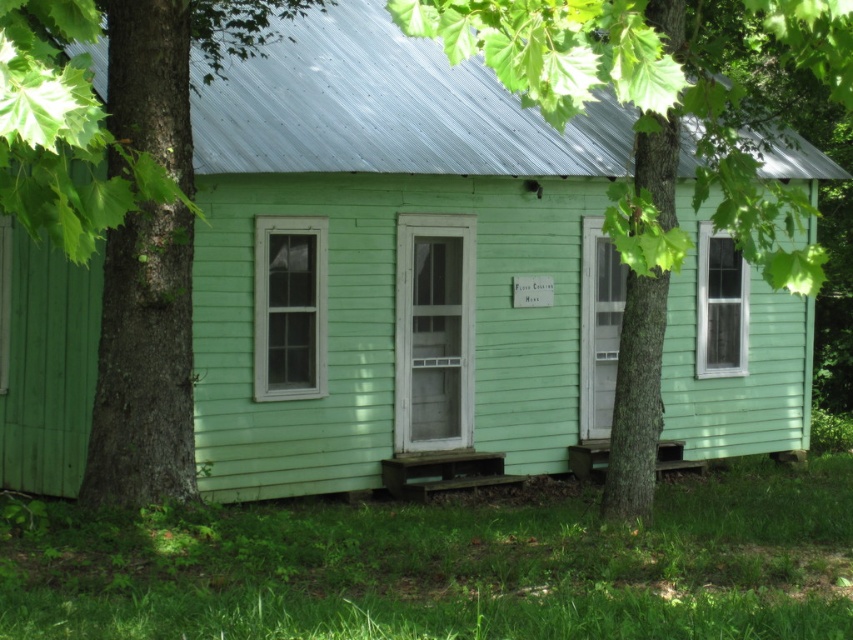
Question: Among these objects, which one is nearest to the camera?

Choices:
 (A) green rough bark tree at left
 (B) green wood tree at center

Answer: (A)

Question: Considering the relative positions of green rough bark tree at left and green wood tree at center in the image provided, where is green rough bark tree at left located with respect to green wood tree at center?

Choices:
 (A) below
 (B) above

Answer: (B)

Question: Which object is closer to the camera taking this photo?

Choices:
 (A) green rough bark tree at left
 (B) green wood tree at center

Answer: (A)

Question: Can you confirm if green rough bark tree at left is bigger than green wood tree at center?

Choices:
 (A) yes
 (B) no

Answer: (B)

Question: Is green rough bark tree at left bigger than green wood tree at center?

Choices:
 (A) yes
 (B) no

Answer: (B)

Question: Which point is farther to the camera?

Choices:
 (A) [x=666, y=24]
 (B) [x=192, y=465]

Answer: (B)